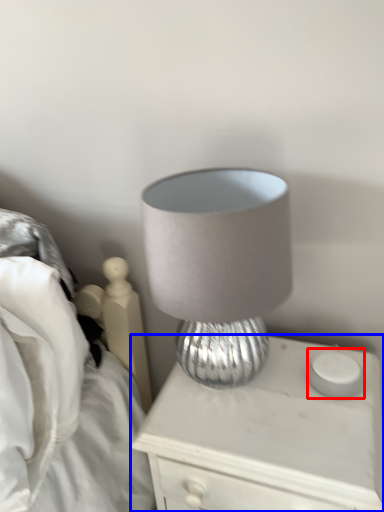
Question: Which object is further to the camera taking this photo, candle holder (highlighted by a red box) or nightstand (highlighted by a blue box)?

Choices:
 (A) candle holder
 (B) nightstand

Answer: (A)